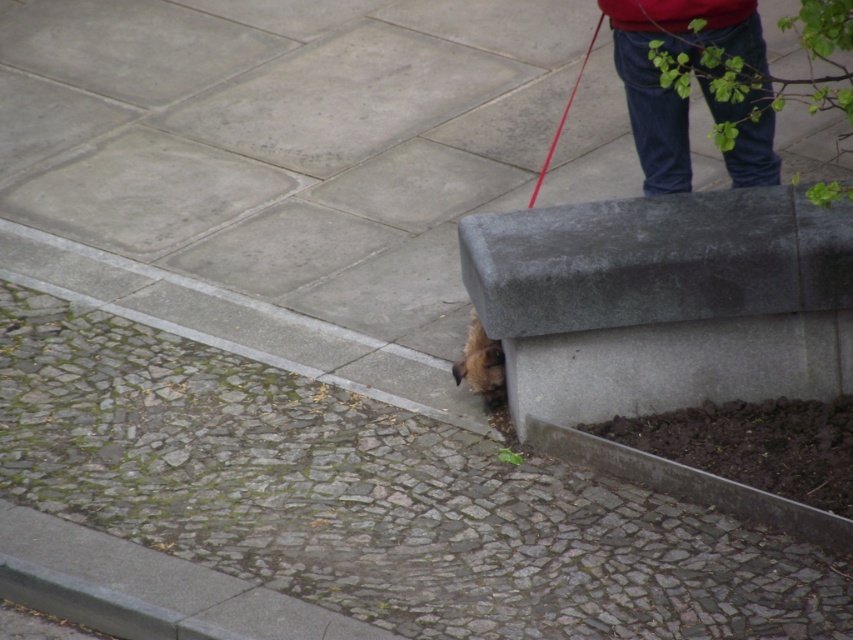
Between point (653, 90) and point (490, 349), which one is positioned in front?

Point (653, 90) is in front.

I want to click on denim pants at upper right, so [x=659, y=74].

Can you confirm if denim pants at upper right is taller than red rubber leash at upper right?

No, denim pants at upper right is not taller than red rubber leash at upper right.

This screenshot has width=853, height=640. I want to click on denim pants at upper right, so click(659, 74).

Which is in front, point (479, 333) or point (538, 179)?

Positioned in front is point (479, 333).

Is point (474, 316) farther from camera compared to point (573, 86)?

No, (474, 316) is in front of (573, 86).

This screenshot has width=853, height=640. I want to click on brown furry dog at lower center, so click(480, 364).